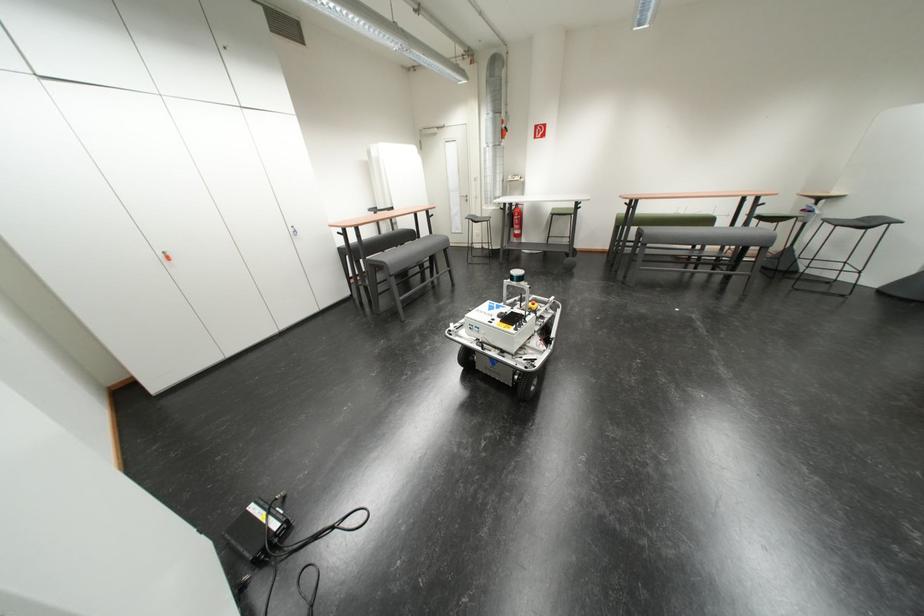
This screenshot has height=616, width=924. What do you see at coordinates (532, 305) in the screenshot? I see `the yellow emergency button` at bounding box center [532, 305].